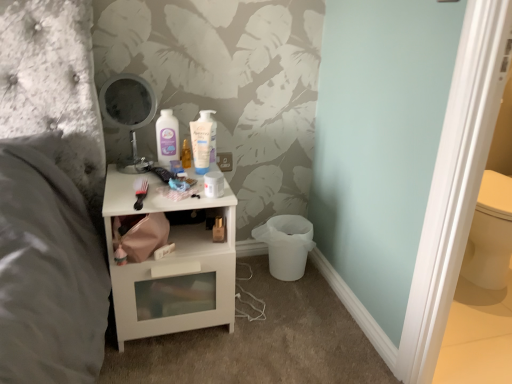
Question: Is white glossy nightstand at center bigger than metallic round mirror at upper center?

Choices:
 (A) no
 (B) yes

Answer: (B)

Question: Does white glossy nightstand at center lie in front of metallic round mirror at upper center?

Choices:
 (A) no
 (B) yes

Answer: (B)

Question: Does white glossy nightstand at center turn towards metallic round mirror at upper center?

Choices:
 (A) no
 (B) yes

Answer: (A)

Question: Can you confirm if white glossy nightstand at center is taller than metallic round mirror at upper center?

Choices:
 (A) yes
 (B) no

Answer: (A)

Question: Are white glossy nightstand at center and metallic round mirror at upper center beside each other?

Choices:
 (A) no
 (B) yes

Answer: (A)

Question: Is point (215, 152) positioned closer to the camera than point (116, 94)?

Choices:
 (A) closer
 (B) farther

Answer: (B)

Question: Considering the positions of white glossy mouthwash at center, which ranks as the 2th mouthwash in left-to-right order, and metallic round mirror at upper center in the image, is white glossy mouthwash at center, which ranks as the 2th mouthwash in left-to-right order, bigger or smaller than metallic round mirror at upper center?

Choices:
 (A) small
 (B) big

Answer: (A)

Question: From the image's perspective, relative to metallic round mirror at upper center, is white glossy mouthwash at center, which ranks as the 2th mouthwash in left-to-right order, above or below?

Choices:
 (A) below
 (B) above

Answer: (A)

Question: From a real-world perspective, is white glossy mouthwash at center, which is the first mouthwash from right to left, positioned above or below metallic round mirror at upper center?

Choices:
 (A) above
 (B) below

Answer: (B)

Question: In terms of width, does white glossy nightstand at center look wider or thinner when compared to matte plastic mouthwash at center, the 1th mouthwash from the left?

Choices:
 (A) thin
 (B) wide

Answer: (B)

Question: Is white glossy nightstand at center bigger or smaller than matte plastic mouthwash at center, positioned as the 2th mouthwash in right-to-left order?

Choices:
 (A) small
 (B) big

Answer: (B)

Question: Is white glossy nightstand at center inside the boundaries of matte plastic mouthwash at center, positioned as the 2th mouthwash in right-to-left order, or outside?

Choices:
 (A) outside
 (B) inside

Answer: (A)

Question: Considering their positions, is white glossy nightstand at center located in front of or behind matte plastic mouthwash at center, positioned as the 2th mouthwash in right-to-left order?

Choices:
 (A) behind
 (B) front

Answer: (B)

Question: From the image's perspective, relative to matte plastic mouthwash at center, positioned as the 2th mouthwash in right-to-left order, is metallic round mirror at upper center above or below?

Choices:
 (A) above
 (B) below

Answer: (A)

Question: Is metallic round mirror at upper center in front of or behind matte plastic mouthwash at center, the 1th mouthwash from the left, in the image?

Choices:
 (A) behind
 (B) front

Answer: (B)